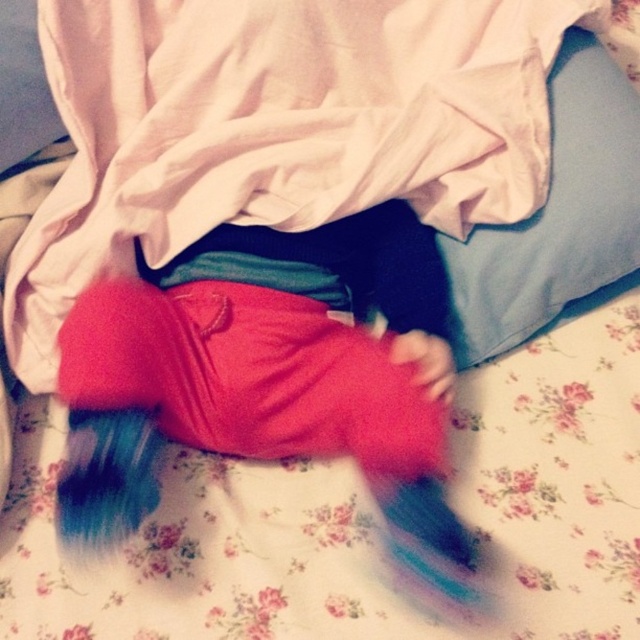
You are a photographer setting up a shoot in this bedroom scene. You need to place a small prop between the fluffy red pants at center and the light blue fabric pillow at upper right. Where should you position it so it sits between them without overlapping either?

Position the prop between the fluffy red pants at center and the light blue fabric pillow at upper right by placing it in the space between them, ensuring it is not overlapping either object. Since the fluffy red pants at center is in front of the light blue fabric pillow at upper right, place the prop in front of the pillow but behind the pants to maintain their spatial relationship.

You are a delivery robot with a 12 inch wide package. You need to place the package between the fluffy red pants at center and the light blue fabric pillow at upper right. Is there enough space?

The distance between the fluffy red pants at center and the light blue fabric pillow at upper right is 10.32 inches. Since the package is 12 inches wide, it will not fit in the available space.

You are a delivery robot entering a bedroom and need to place a package on the bed. The bed has a floral bedsheet with pink flowers. Where should you place the package so it doesn not land on any part of the person lying on the bed? The person is covered by a light pink blanket and wearing red garment with blue patterned hem. The objects on the bed include a fluffy red pants at center located at point (x=264, y=376). Please provide coordinates in the format of point in the image. The coordinate system is from

The package should be placed away from the fluffy red pants at center located at point (x=264, y=376) to avoid the person. Since the person is lying on their side covered by the blanket, placing the package on the floral bedsheet area not occupied by the fluffy red pants at center would be safe. For example, coordinates like point 0.3, 0.6 or point 0.7, 0.3 could work, ensuring it stays clear of the person and their belongings.